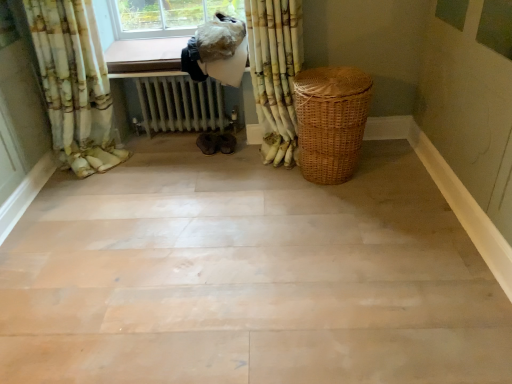
Locate an element on the screen. free location to the right of woven brown basket at right is located at coordinates (390, 170).